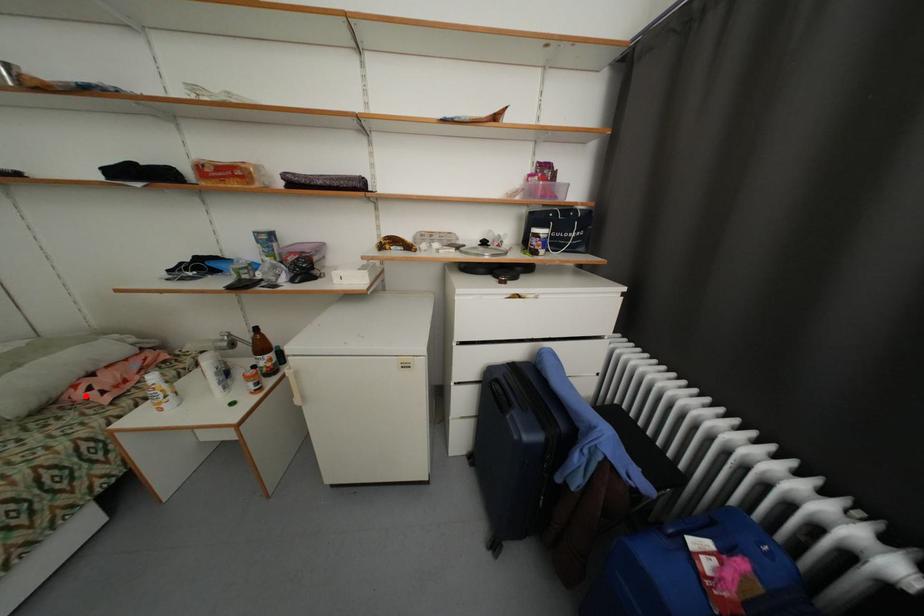
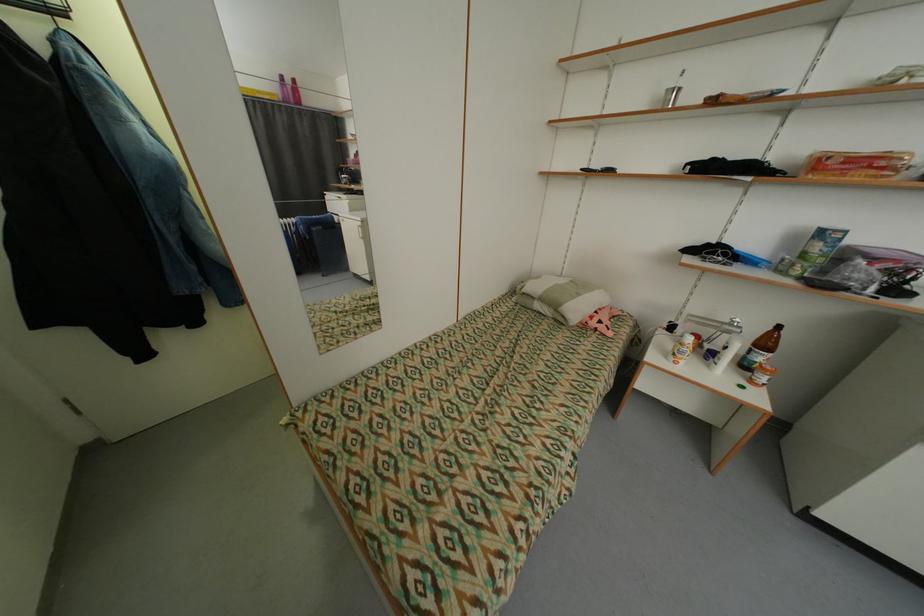
Find the pixel in the second image that matches the highlighted location in the first image.

(600, 323)